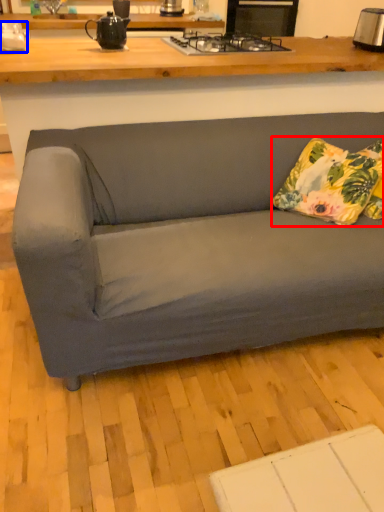
Question: Which of the following is the farthest to the observer, pillow (highlighted by a red box) or appliance (highlighted by a blue box)?

Choices:
 (A) pillow
 (B) appliance

Answer: (B)